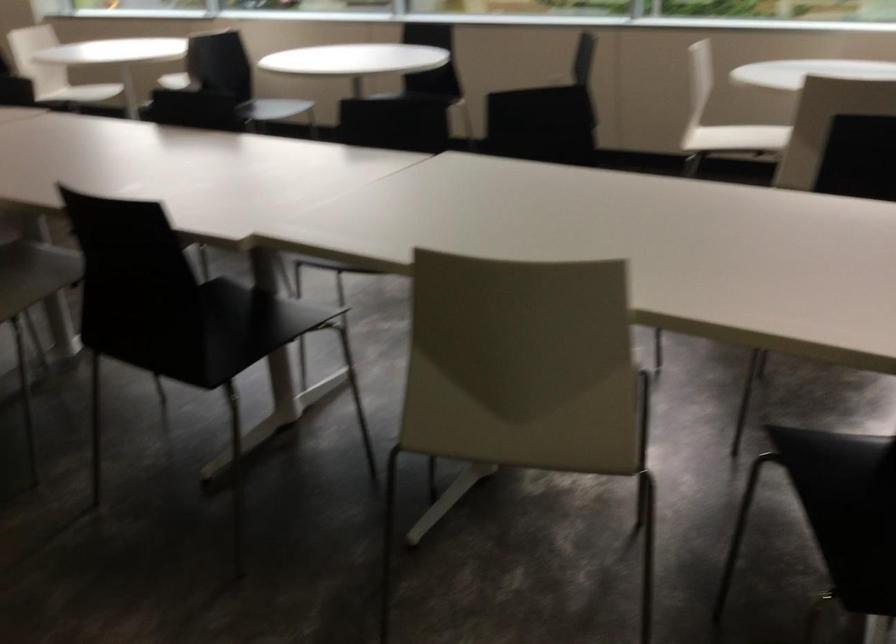
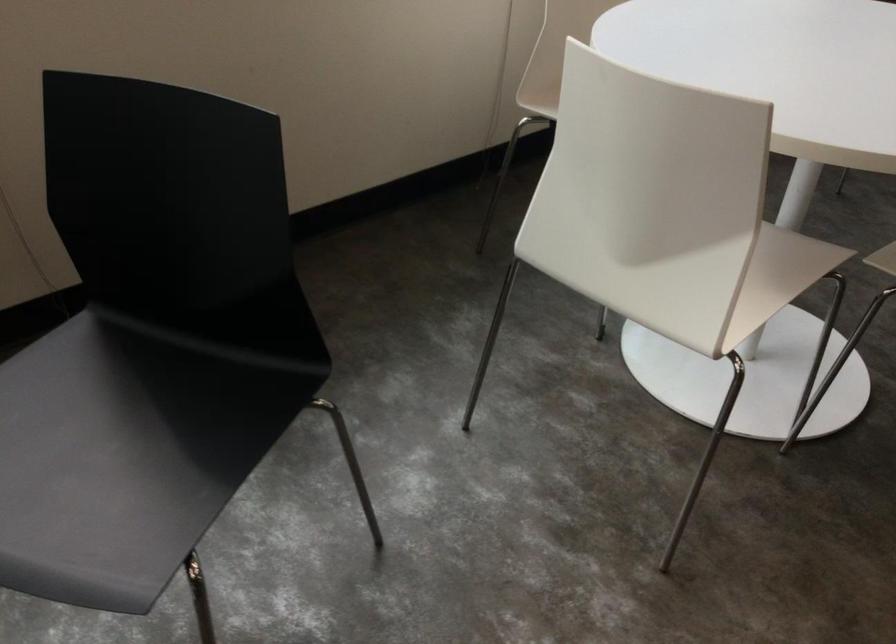
Where in the second image is the point corresponding to point 754,140 from the first image?

(777, 277)